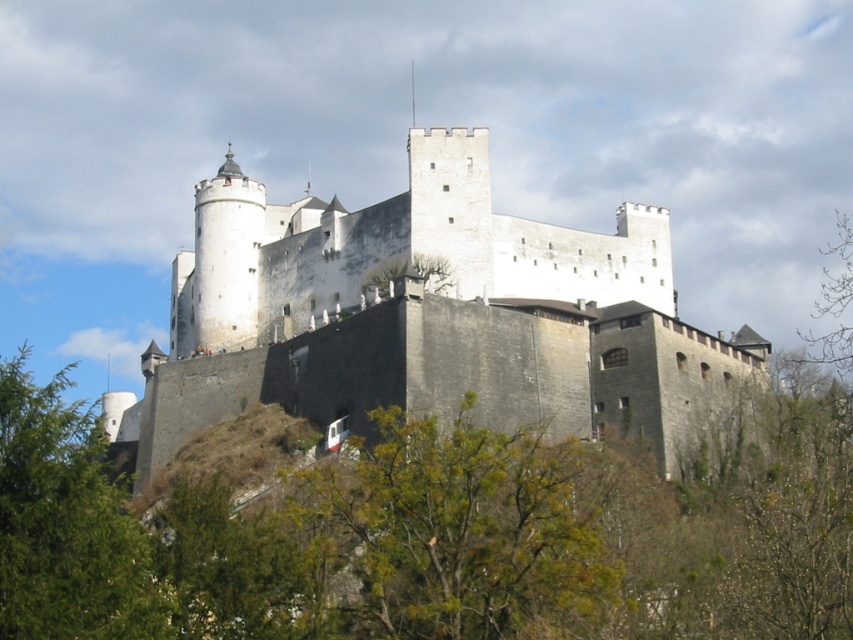
Question: From the image, what is the correct spatial relationship of white stone castle at center in relation to green leafy tree at lower center?

Choices:
 (A) below
 (B) above

Answer: (B)

Question: Which object is positioned farthest from the green leafy tree at lower center?

Choices:
 (A) green leafy tree at lower left
 (B) white stone castle at center

Answer: (B)

Question: Which point is farther to the camera?

Choices:
 (A) white stone castle at center
 (B) green leafy tree at lower left
 (C) green leafy tree at lower center

Answer: (A)

Question: Does white stone castle at center appear under green leafy tree at lower center?

Choices:
 (A) no
 (B) yes

Answer: (A)

Question: Where is white stone castle at center located in relation to green leafy tree at lower center in the image?

Choices:
 (A) right
 (B) left

Answer: (B)

Question: Which object is the farthest from the green leafy tree at lower center?

Choices:
 (A) white stone castle at center
 (B) green leafy tree at lower left

Answer: (A)